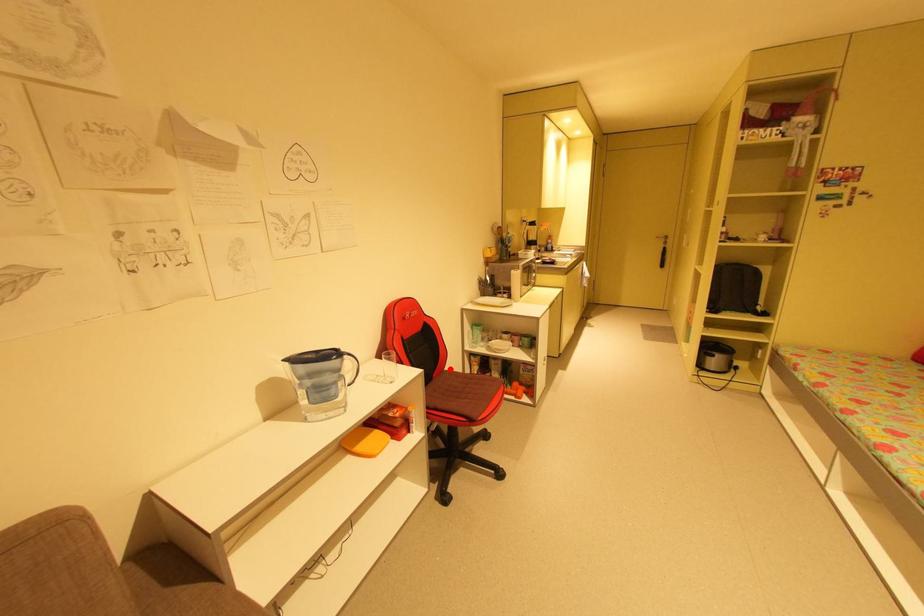
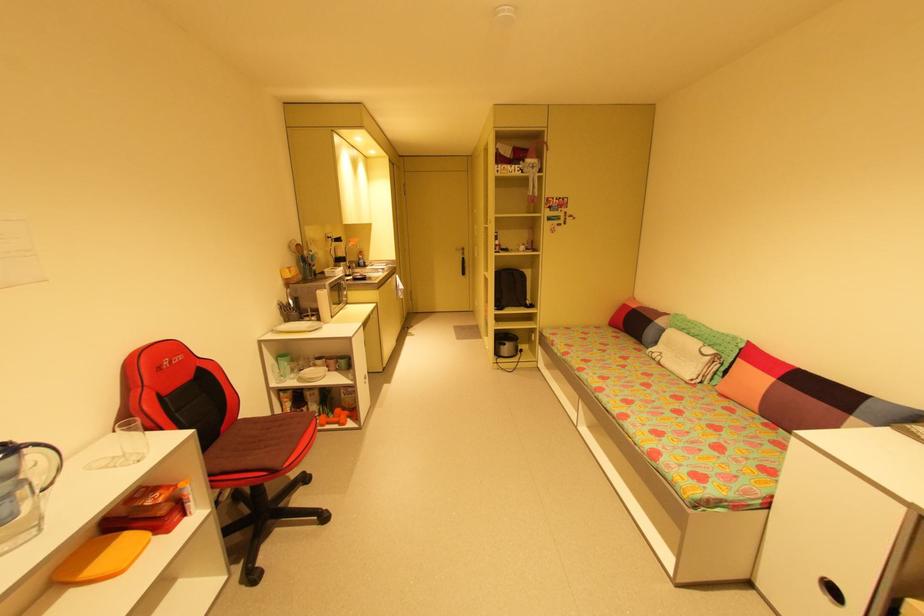
Where in the second image is the point corresponding to the highlighted location from the first image?

(244, 418)